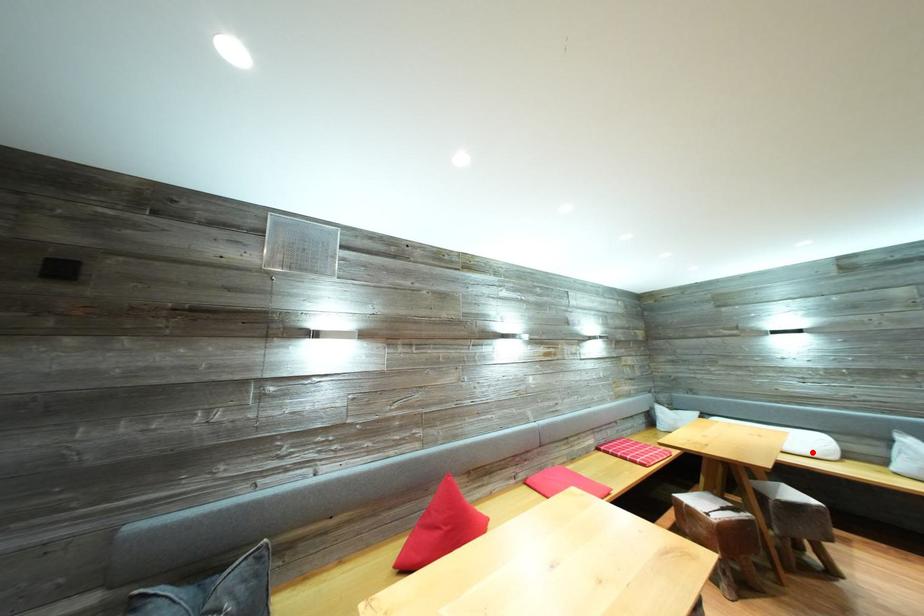
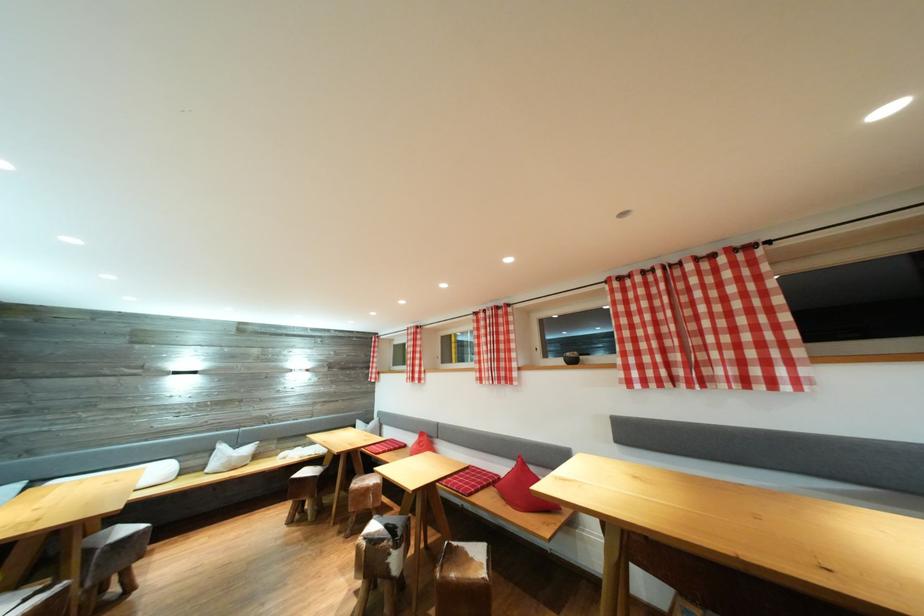
Question: I am providing you with two images of the same scene from different viewpoints. Given a red point in image1, look at the same physical point in image2. Is it:

Choices:
 (A) Closer to the viewpoint
 (B) Farther from the viewpoint

Answer: (B)